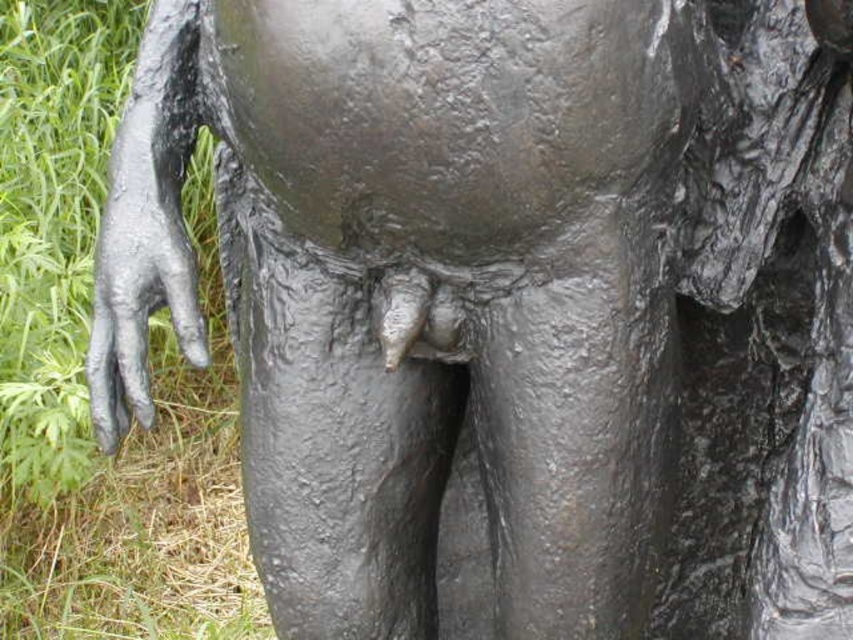
Between point (24, 401) and point (97, 294), which one is positioned behind?

The point (24, 401) is behind.

This screenshot has width=853, height=640. What do you see at coordinates (83, 371) in the screenshot? I see `green grass at left` at bounding box center [83, 371].

This screenshot has width=853, height=640. Describe the element at coordinates (83, 371) in the screenshot. I see `green grass at left` at that location.

Locate an element on the screen. This screenshot has height=640, width=853. green grass at left is located at coordinates (83, 371).